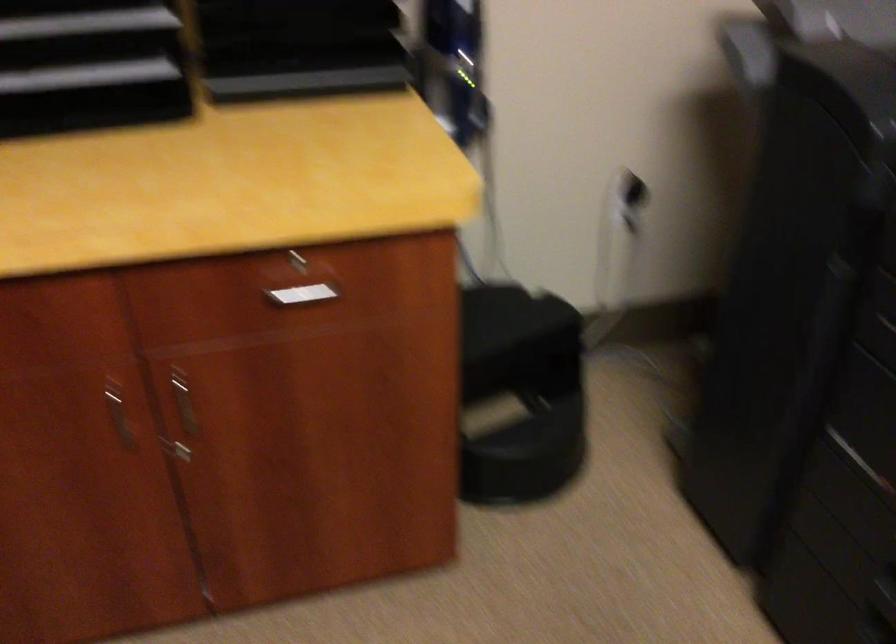
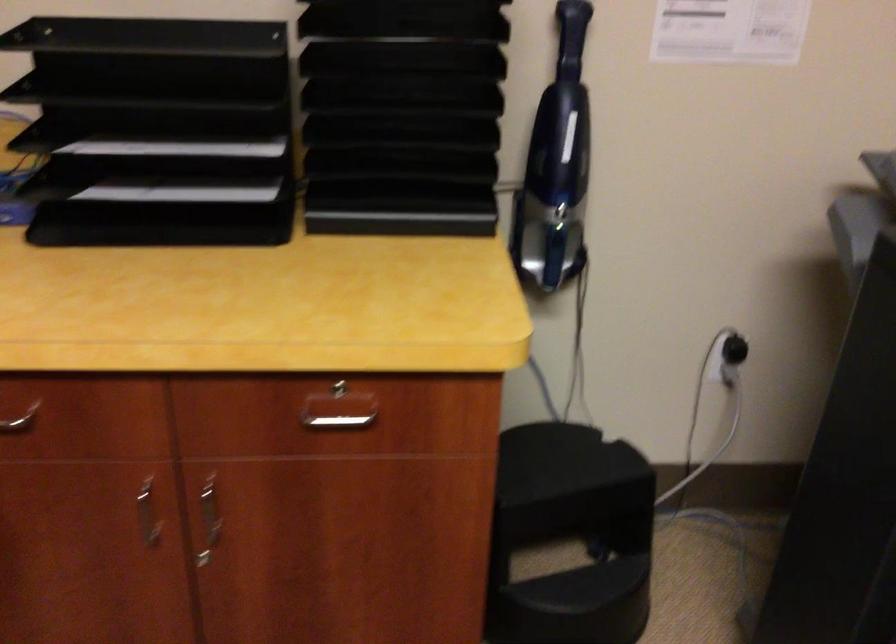
Where in the second image is the point corresponding to point 631,200 from the first image?

(730, 357)